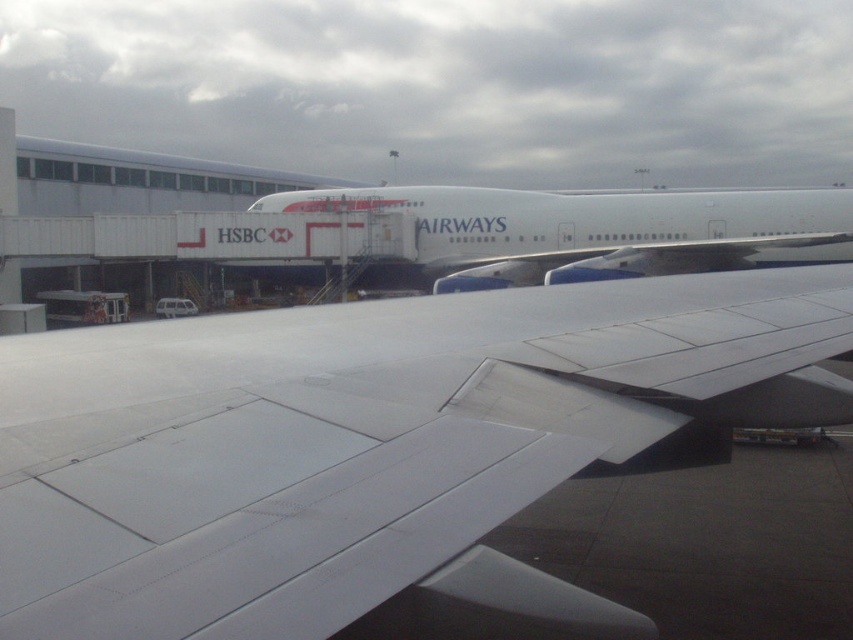
You are a maintenance technician at the airport and need to access the white matte wing at center for inspection. The jet bridge is positioned at point 0.5, 0.5. Can you reach the wing from the jet bridge without moving the bridge?

The white matte wing at center is located at point (376, 451), which is further to the right and slightly lower than the jet bridge at (426, 320). Therefore, you would need to move the jet bridge to reach the wing.

You are standing at the airport tarmac and want to determine the relative positions of two points marked on the airplane wing. Which point, point 1 at coordinates (729, 284) or point 2 at coordinates (697, 224), is closer to you?

Point 1 at coordinates (729, 284) is closer to the viewer than point 2 at coordinates (697, 224).